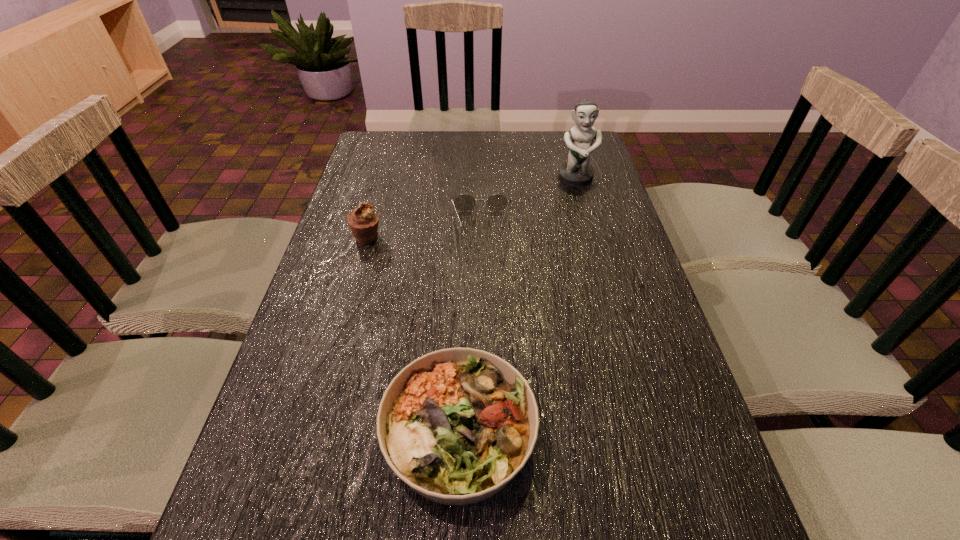
Locate an element on the screen. The width and height of the screenshot is (960, 540). blank space located on the front-facing side of the spectacles is located at coordinates (482, 347).

Where is `object at the left edge`? The width and height of the screenshot is (960, 540). object at the left edge is located at coordinates (363, 221).

Where is `object that is at the right edge`? The image size is (960, 540). object that is at the right edge is located at coordinates (577, 172).

You are a GUI agent. You are given a task and a screenshot of the screen. Output one action in this format:
    pyautogui.click(x=<x>, y=<y>)
    Task: Click on the free space at the far edge
    This screenshot has width=960, height=540.
    Given the screenshot: What is the action you would take?
    pyautogui.click(x=544, y=131)

Find the location of a particular element. This screenshot has height=540, width=960. blank space at the left edge is located at coordinates (324, 382).

Find the location of a particular element. The height and width of the screenshot is (540, 960). vacant space at the right edge of the desktop is located at coordinates (623, 245).

The height and width of the screenshot is (540, 960). In the image, there is a desktop. In order to click on vacant space at the far left corner in this screenshot , I will do `click(404, 157)`.

This screenshot has width=960, height=540. Find the location of `free space between the rightmost object and the shortest object`. free space between the rightmost object and the shortest object is located at coordinates (529, 201).

The width and height of the screenshot is (960, 540). In order to click on free area in between the shortest object and the leftmost object in this screenshot , I will do `click(424, 230)`.

Locate an element on the screen. free point between the salad plate and the leftmost object is located at coordinates (414, 335).